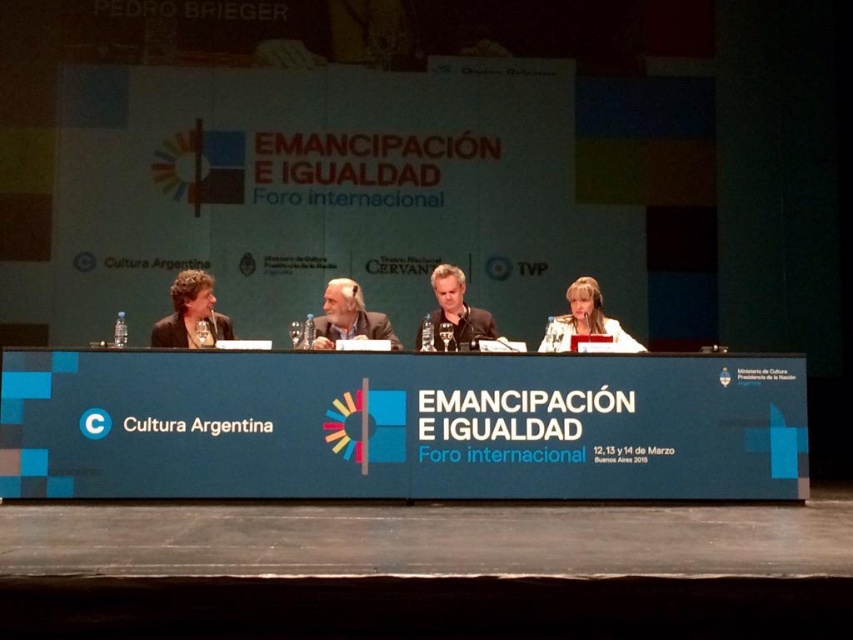
Between matte black jacket at left and white fabric at center, which one has more height?

white fabric at center

Can you confirm if matte black jacket at left is shorter than white fabric at center?

Yes.

Locate an element on the screen. matte black jacket at left is located at coordinates (190, 312).

Which is below, matte black shirt at center or white fabric at center?

white fabric at center

Is matte black shirt at center positioned in front of white fabric at center?

Yes, matte black shirt at center is closer to the viewer.

The height and width of the screenshot is (640, 853). What do you see at coordinates (451, 316) in the screenshot?
I see `matte black shirt at center` at bounding box center [451, 316].

In order to click on matte black shirt at center in this screenshot , I will do click(451, 316).

Is point (355, 317) farther from camera compared to point (558, 333)?

Yes, it is behind point (558, 333).

Is point (314, 340) closer to camera compared to point (613, 339)?

Yes, it is.

Find the location of a particular element. This screenshot has height=640, width=853. gray hair at center is located at coordinates (347, 317).